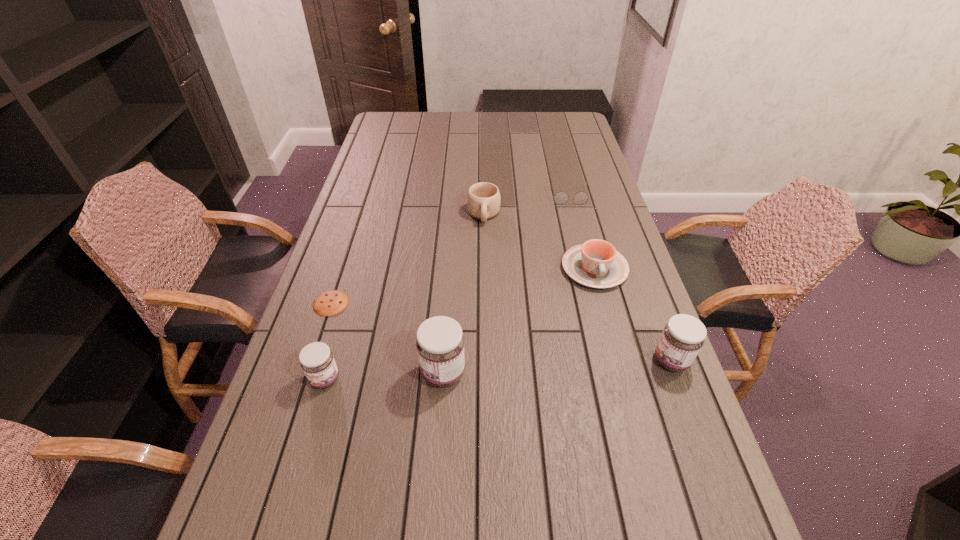
I want to click on jam at the left edge, so click(x=316, y=359).

Where is `cookie situated at the left edge`? Image resolution: width=960 pixels, height=540 pixels. cookie situated at the left edge is located at coordinates (332, 302).

Where is `jam situated at the right edge`? Image resolution: width=960 pixels, height=540 pixels. jam situated at the right edge is located at coordinates (683, 336).

This screenshot has width=960, height=540. Identify the location of spectacles present at the right edge. pyautogui.click(x=561, y=197).

At what (x,y) coordinates should I click in order to perform the action: click on chinaware situated at the right edge. Please return your answer as a coordinate pair (x, y). The image size is (960, 540). Looking at the image, I should click on (595, 263).

In the image, there is a desktop. Identify the location of vacant space at the far edge. The width and height of the screenshot is (960, 540). (495, 117).

The image size is (960, 540). I want to click on vacant space at the near edge of the desktop, so click(589, 464).

Where is `vacant region at the left edge of the desktop`? This screenshot has height=540, width=960. vacant region at the left edge of the desktop is located at coordinates point(343,240).

The image size is (960, 540). I want to click on vacant space at the right edge, so click(660, 366).

The width and height of the screenshot is (960, 540). I want to click on vacant position at the near right corner of the desktop, so click(x=715, y=477).